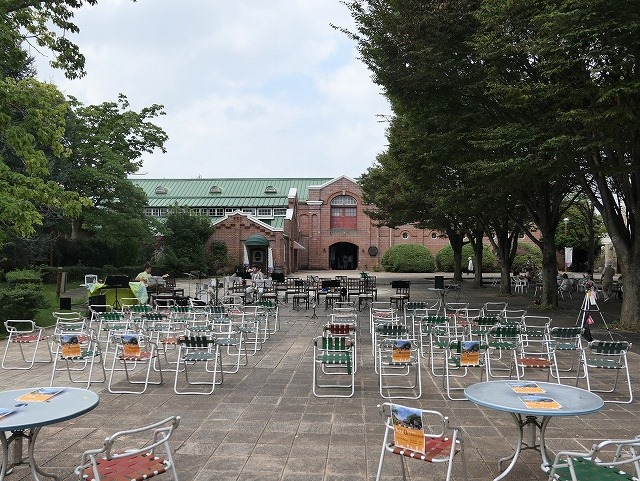
Where is `windows`? Image resolution: width=640 pixels, height=481 pixels. windows is located at coordinates (156, 188), (210, 194), (272, 191), (144, 209), (192, 206), (234, 211), (271, 214), (345, 216), (404, 236), (429, 231).